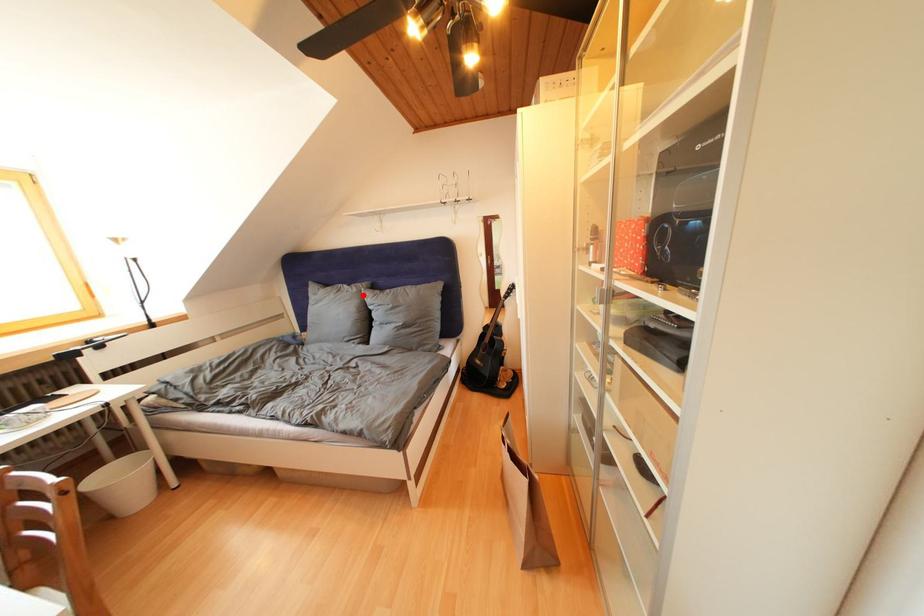
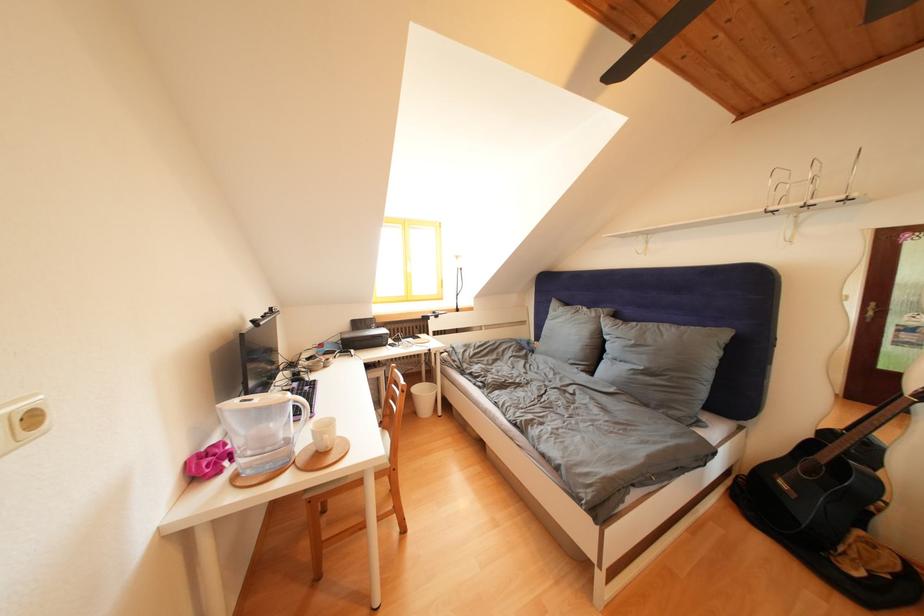
The point at the highlighted location is marked in the first image. Where is the corresponding point in the second image?

(602, 320)